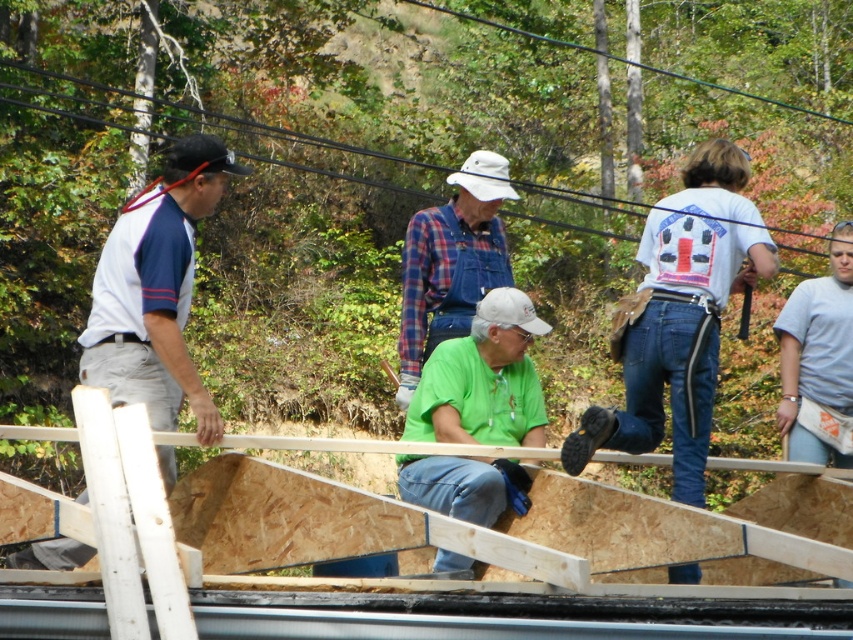
Who is shorter, green matte shirt at center or plaid fabric shirt at center?

Standing shorter between the two is green matte shirt at center.

Does green matte shirt at center appear on the left side of plaid fabric shirt at center?

No, green matte shirt at center is not to the left of plaid fabric shirt at center.

The image size is (853, 640). Find the location of `green matte shirt at center`. green matte shirt at center is located at coordinates (483, 380).

You are a GUI agent. You are given a task and a screenshot of the screen. Output one action in this format:
    pyautogui.click(x=<x>, y=<y>)
    Task: Click on the green matte shirt at center
    Image resolution: width=853 pixels, height=640 pixels.
    Given the screenshot: What is the action you would take?
    pyautogui.click(x=483, y=380)

Does white fabric shirt at left appear over green matte shirt at center?

Correct, white fabric shirt at left is located above green matte shirt at center.

Between point (106, 344) and point (467, 458), which one is positioned in front?

Point (467, 458)

The width and height of the screenshot is (853, 640). In order to click on white fabric shirt at left in this screenshot , I will do 155,291.

Between white fabric shirt at left and plaid fabric shirt at center, which one is positioned lower?

white fabric shirt at left

Which of these two, white fabric shirt at left or plaid fabric shirt at center, stands taller?

plaid fabric shirt at center is taller.

Does point (161, 250) come farther from viewer compared to point (438, 262)?

No, it is not.

You are a GUI agent. You are given a task and a screenshot of the screen. Output one action in this format:
    pyautogui.click(x=<x>, y=<y>)
    Task: Click on the white fabric shirt at left
    The width and height of the screenshot is (853, 640).
    Given the screenshot: What is the action you would take?
    pyautogui.click(x=155, y=291)